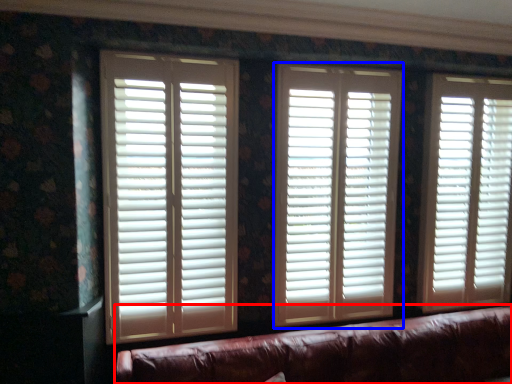
Question: Which point is closer to the camera, studio couch (highlighted by a red box) or window blind (highlighted by a blue box)?

Choices:
 (A) studio couch
 (B) window blind

Answer: (A)